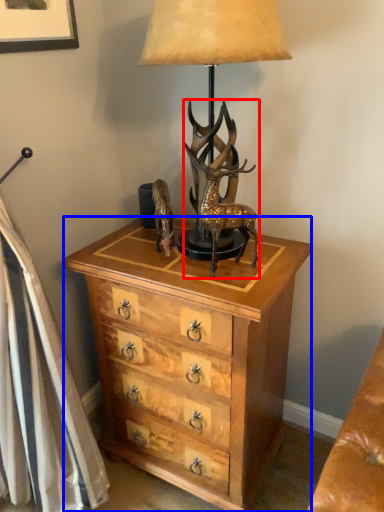
Question: Which object appears farthest to the camera in this image, deer (highlighted by a red box) or chest of drawers (highlighted by a blue box)?

Choices:
 (A) deer
 (B) chest of drawers

Answer: (B)